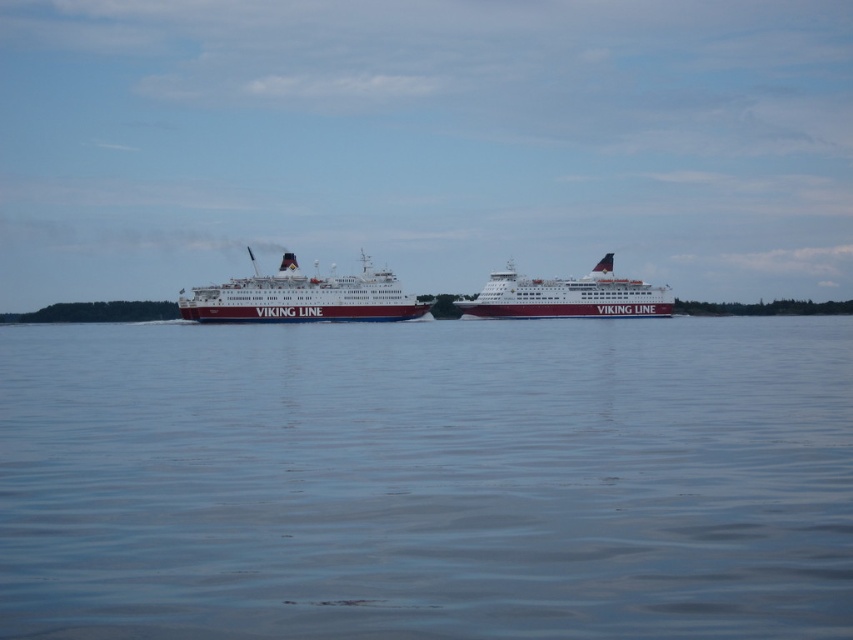
You are a passenger on the ferry and you see two points marked on the water. Which point is closer to you, the point at coordinates point (x=363, y=312) or point (x=549, y=292)?

Point (x=363, y=312) is in front of point (x=549, y=292), so it is closer to you.